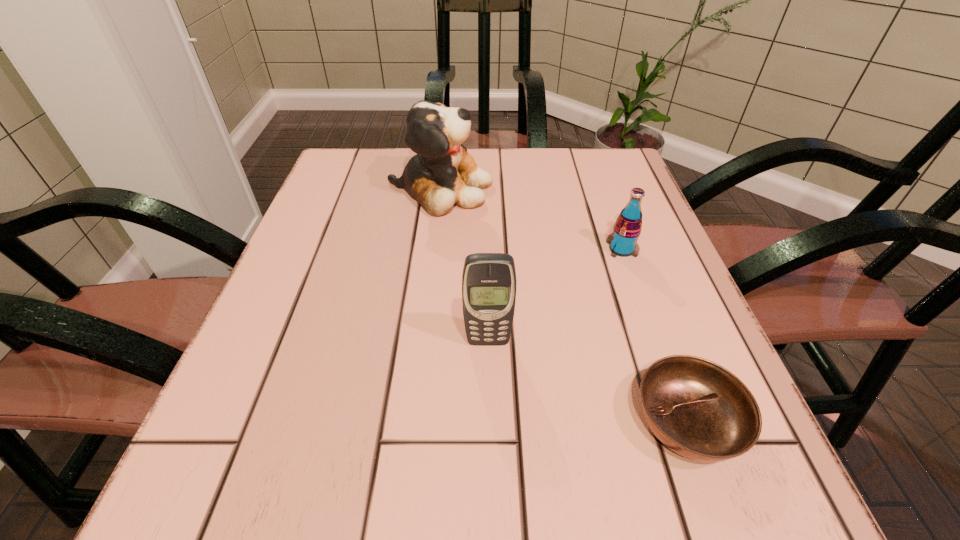
The width and height of the screenshot is (960, 540). Identify the location of the farthest object. (442, 174).

The image size is (960, 540). I want to click on the third farthest object, so click(489, 281).

I want to click on the second shortest object, so click(623, 241).

Find the location of a particular element. This screenshot has height=540, width=960. soda is located at coordinates (623, 241).

Where is `the shortest object`? the shortest object is located at coordinates (698, 409).

This screenshot has height=540, width=960. Identify the location of soup bowl. (698, 409).

Locate an element on the screen. The width and height of the screenshot is (960, 540). free spot located at the face of the farthest object is located at coordinates (589, 189).

Where is `free space located on the screen of the cellular telephone`? free space located on the screen of the cellular telephone is located at coordinates (491, 476).

Identify the location of vacant space situated 0.400m on the front of the third nearest object. The image size is (960, 540). (700, 470).

Identify the location of blank space located on the left of the nearest object. (523, 421).